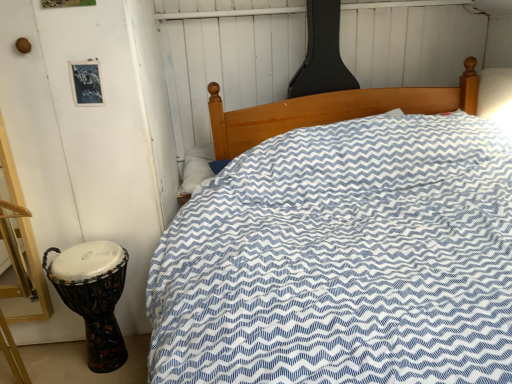
The image size is (512, 384). What do you see at coordinates (93, 296) in the screenshot?
I see `multicolored fabric drum at left` at bounding box center [93, 296].

Locate an element on the screen. This screenshot has height=384, width=512. multicolored fabric drum at left is located at coordinates (93, 296).

Measure the distance between point (x=187, y=161) and camera.

Point (x=187, y=161) is 2.37 meters from camera.

In order to click on white soft pillow at center in this screenshot , I will do `click(197, 167)`.

What do you see at coordinates (197, 167) in the screenshot? I see `white soft pillow at center` at bounding box center [197, 167].

You are a GUI agent. You are given a task and a screenshot of the screen. Output one action in this format:
    pyautogui.click(x=<x>, y=<y>)
    Task: Click on the multicolored fabric drum at left
    
    Given the screenshot: What is the action you would take?
    pyautogui.click(x=93, y=296)

Is multicolored fabric drum at left to the left of white soft pillow at center from the viewer's perspective?

Correct, you'll find multicolored fabric drum at left to the left of white soft pillow at center.

Is multicolored fabric drum at left in front of white soft pillow at center?

Yes, multicolored fabric drum at left is in front of white soft pillow at center.

Considering the points (62, 261) and (189, 187), which point is behind, point (62, 261) or point (189, 187)?

The point (189, 187) is behind.

From the image's perspective, which is below, multicolored fabric drum at left or white soft pillow at center?

multicolored fabric drum at left, from the image's perspective.

From a real-world perspective, is multicolored fabric drum at left above or below white soft pillow at center?

In terms of real-world spatial position, multicolored fabric drum at left is below white soft pillow at center.

Can you confirm if multicolored fabric drum at left is thinner than white soft pillow at center?

Incorrect, the width of multicolored fabric drum at left is not less than that of white soft pillow at center.

Is multicolored fabric drum at left taller or shorter than white soft pillow at center?

Considering their sizes, multicolored fabric drum at left has more height than white soft pillow at center.

Looking at this image, between multicolored fabric drum at left and white soft pillow at center, which one has smaller size?

white soft pillow at center.

Is multicolored fabric drum at left spatially inside white soft pillow at center, or outside of it?

multicolored fabric drum at left is located beyond the bounds of white soft pillow at center.

Can you see multicolored fabric drum at left touching white soft pillow at center?

No, multicolored fabric drum at left is not making contact with white soft pillow at center.

Is multicolored fabric drum at left oriented towards white soft pillow at center?

No, multicolored fabric drum at left is not facing towards white soft pillow at center.

How many degrees apart are the facing directions of multicolored fabric drum at left and white soft pillow at center?

There is a 0.00031-degree angle between the facing directions of multicolored fabric drum at left and white soft pillow at center.

The height and width of the screenshot is (384, 512). I want to click on pillow above the multicolored fabric drum at left (from a real-world perspective), so coord(197,167).

Between white soft pillow at center and multicolored fabric drum at left, which one appears on the right side from the viewer's perspective?

white soft pillow at center.

Which object is closer to the camera, white soft pillow at center or multicolored fabric drum at left?

multicolored fabric drum at left.

Considering the positions of points (192, 179) and (79, 301), is point (192, 179) closer to camera compared to point (79, 301)?

No, it is not.

From the image's perspective, which is below, white soft pillow at center or multicolored fabric drum at left?

multicolored fabric drum at left is shown below in the image.

From a real-world perspective, between white soft pillow at center and multicolored fabric drum at left, who is vertically lower?

multicolored fabric drum at left is physically lower.

Between white soft pillow at center and multicolored fabric drum at left, which one has larger width?

→ multicolored fabric drum at left.

Is white soft pillow at center shorter than multicolored fabric drum at left?

Correct, white soft pillow at center is not as tall as multicolored fabric drum at left.

Which of these two, white soft pillow at center or multicolored fabric drum at left, is bigger?

multicolored fabric drum at left is bigger.

Which is correct: white soft pillow at center is inside multicolored fabric drum at left, or outside of it?

The correct answer is: outside.

Is white soft pillow at center beside multicolored fabric drum at left?

There is a gap between white soft pillow at center and multicolored fabric drum at left.

Is white soft pillow at center facing towards multicolored fabric drum at left?

Yes, white soft pillow at center faces towards multicolored fabric drum at left.

Can you tell me how much white soft pillow at center and multicolored fabric drum at left differ in facing direction?

There is a 0.00031-degree angle between the facing directions of white soft pillow at center and multicolored fabric drum at left.

Locate an element on the screen. This screenshot has height=384, width=512. drum directly beneath the white soft pillow at center (from a real-world perspective) is located at coordinates (93, 296).

Where is `drum on the left of white soft pillow at center`? drum on the left of white soft pillow at center is located at coordinates (93, 296).

You are a GUI agent. You are given a task and a screenshot of the screen. Output one action in this format:
    pyautogui.click(x=<x>, y=<y>)
    Task: Click on the drum located in front of the white soft pillow at center
    
    Given the screenshot: What is the action you would take?
    pyautogui.click(x=93, y=296)